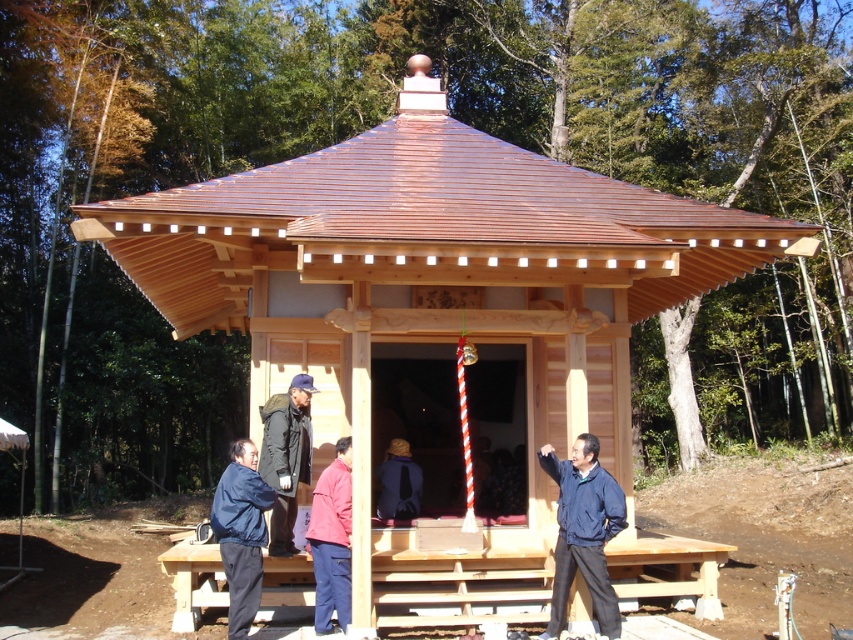
You are a visitor at the pavilion and notice two jackets hanging at the center. Which jacket is closer to you, the blue fabric jacket at center or the dark blue jacket at center?

The blue fabric jacket at center is closer to you because it is positioned under the dark blue jacket at center, meaning the dark blue jacket is above it and farther away.

Consider the image. You are organizing a photo shoot in the pavilion and need to arrange the blue fabric jacket at lower left and dark blue jacket at center for a scene. If the space between the two jackets must be at least 1.2 meters wide, will the jackets fit side by side without overlapping?

The blue fabric jacket at lower left has a lesser width compared to the dark blue jacket at center. However, the exact widths of the jackets are not provided in the scene description, so it is impossible to determine if they can fit side by side without overlapping based on the given information.